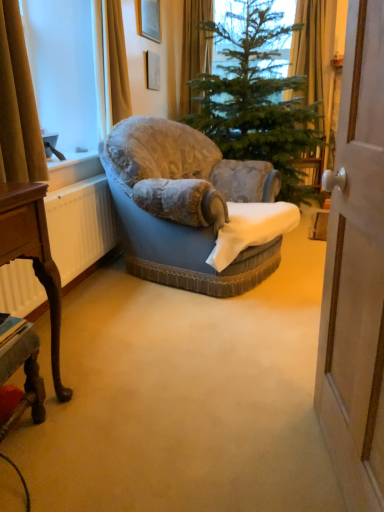
Locate an element on the screen. The image size is (384, 512). vacant area that is in front of white matte radiator at left is located at coordinates (105, 340).